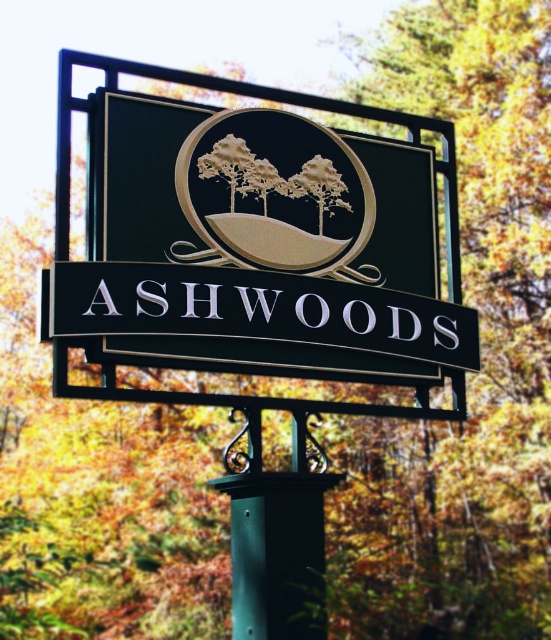
Is metallic gold sign at center above matte gold emblem at center?

No, metallic gold sign at center is not above matte gold emblem at center.

Can you confirm if metallic gold sign at center is shorter than matte gold emblem at center?

No, metallic gold sign at center is not shorter than matte gold emblem at center.

What do you see at coordinates (267, 243) in the screenshot?
I see `metallic gold sign at center` at bounding box center [267, 243].

At what (x,y) coordinates should I click in order to perform the action: click on metallic gold sign at center. Please return your answer as a coordinate pair (x, y). The height and width of the screenshot is (640, 551). Looking at the image, I should click on (267, 243).